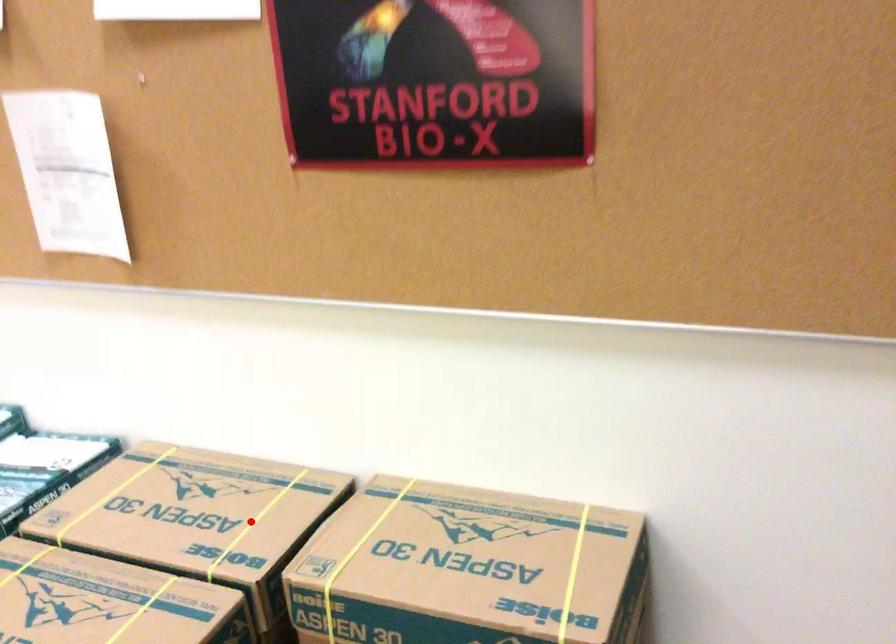
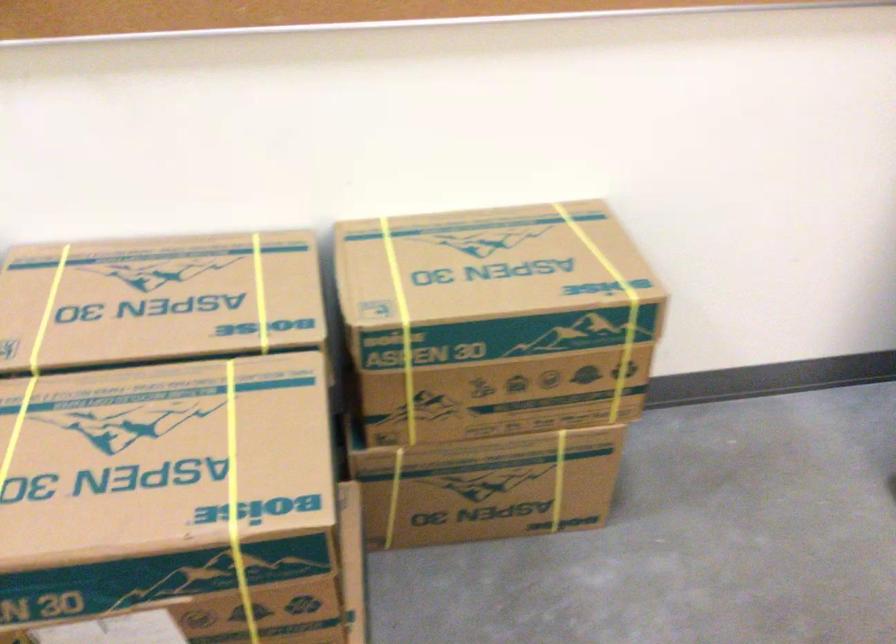
The point at the highlighted location is marked in the first image. Where is the corresponding point in the second image?

(260, 292)